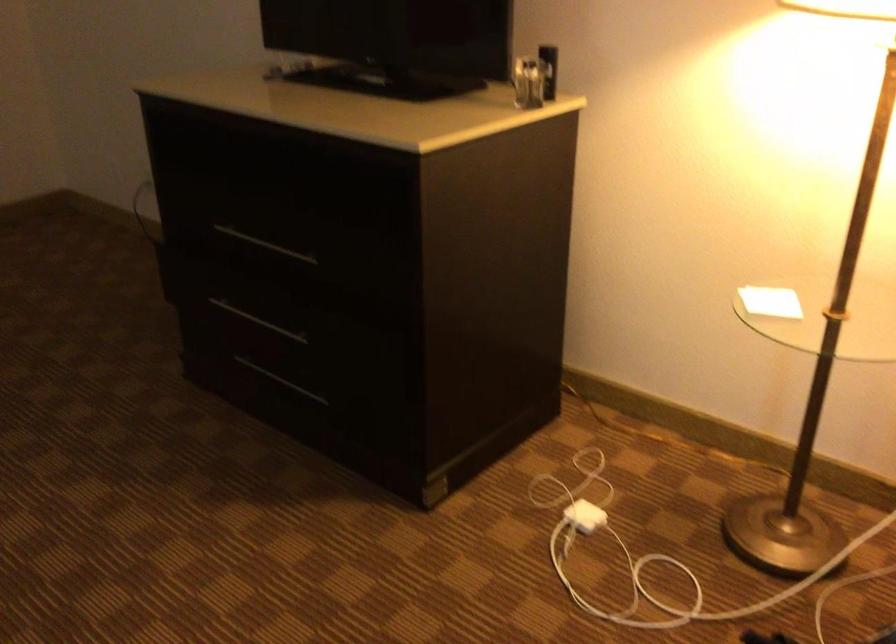
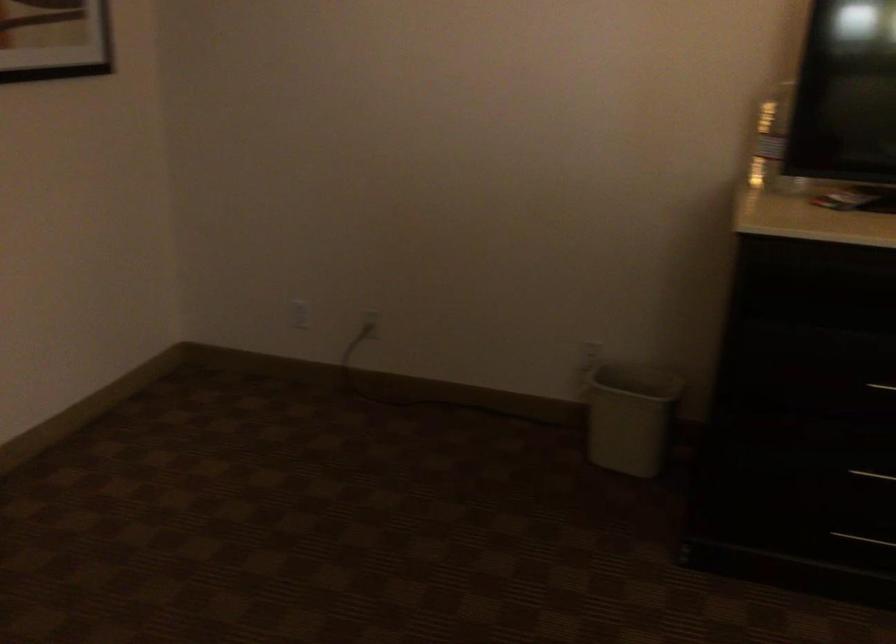
Question: The images are taken continuously from a first-person perspective. In which direction are you moving?

Choices:
 (A) Left
 (B) Right
 (C) Forward
 (D) Backward

Answer: (A)